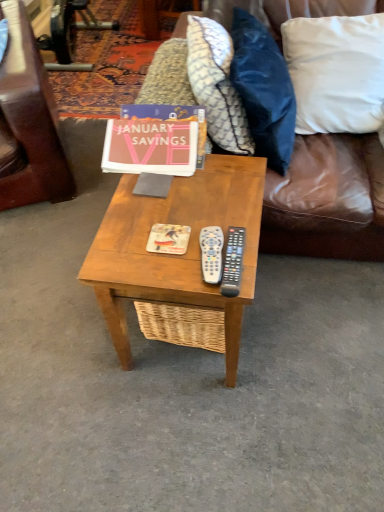
Identify the location of free location to the right of woodenwoodencoffee table at center. (314, 323).